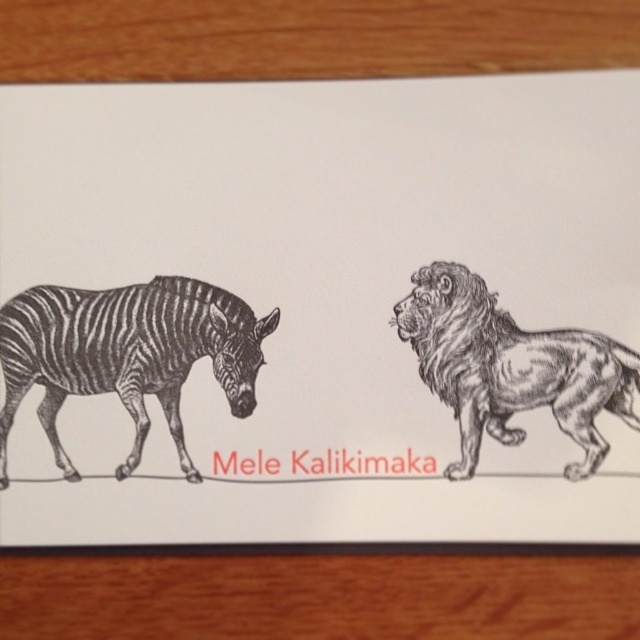
You are designing a greeting card and want to ensure the animals are arranged properly. According to the image, which animal is positioned higher on the card, the black and white striped zebra at left or the black ink lion at right?

The black and white striped zebra at left is located above the black ink lion at right, so it is positioned higher on the card.

You are designing a greeting card and want to place a sticker exactly at point [125,353]. The card has a zebra on the left and a lion on the right. Where will the sticker be placed?

The sticker at point [125,353] will be placed on the black and white striped zebra at left.